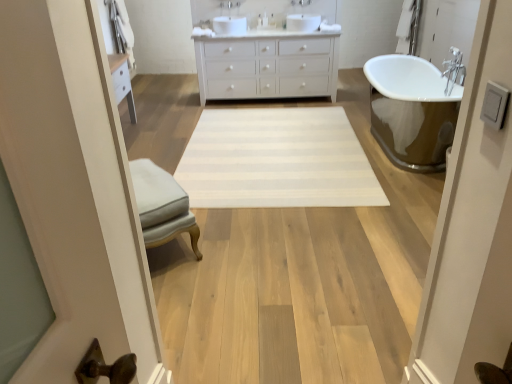
The width and height of the screenshot is (512, 384). Describe the element at coordinates (267, 65) in the screenshot. I see `white matte cabinet at center` at that location.

What is the approximate height of white matte cabinet at center?

white matte cabinet at center is 33.17 inches in height.

Find the location of a particular element. white striped rug at center is located at coordinates (277, 160).

Where is `white matte cabinet at center`? white matte cabinet at center is located at coordinates (267, 65).

Considering the positions of objects white matte cabinet at center and white striped rug at center in the image provided, who is behind, white matte cabinet at center or white striped rug at center?

white matte cabinet at center.

Is white striped rug at center completely or partially inside white matte cabinet at center?

Actually, white striped rug at center is outside white matte cabinet at center.

Who is shorter, white matte cabinet at center or white striped rug at center?

Standing shorter between the two is white striped rug at center.

Which is more to the left, white matte cabinet at center or white striped rug at center?

Positioned to the left is white striped rug at center.

Considering the sizes of objects light gray fabric ottoman at center and white striped rug at center in the image provided, who is wider, light gray fabric ottoman at center or white striped rug at center?

white striped rug at center.

From the image's perspective, is light gray fabric ottoman at center located above or below white striped rug at center?

Clearly, from the image's perspective, light gray fabric ottoman at center is below white striped rug at center.

You are a GUI agent. You are given a task and a screenshot of the screen. Output one action in this format:
    pyautogui.click(x=<x>, y=<y>)
    Task: Click on the plain below the light gray fabric ottoman at center (from a real-world perspective)
    The width and height of the screenshot is (512, 384).
    Given the screenshot: What is the action you would take?
    pyautogui.click(x=277, y=160)

Considering the positions of objects light gray fabric ottoman at center and white striped rug at center in the image provided, who is more to the left, light gray fabric ottoman at center or white striped rug at center?

light gray fabric ottoman at center is more to the left.

Is point (183, 197) farther from camera compared to point (303, 41)?

No.

Is light gray fabric ottoman at center surrounding white matte cabinet at center?

No, light gray fabric ottoman at center does not contain white matte cabinet at center.

Does light gray fabric ottoman at center appear on the right side of white matte cabinet at center?

In fact, light gray fabric ottoman at center is to the left of white matte cabinet at center.

Who is more distant, light gray fabric ottoman at center or white matte cabinet at center?

white matte cabinet at center is further away from the camera.

Visually, is white matte cabinet at center positioned to the left or to the right of light gray fabric ottoman at center?

white matte cabinet at center is positioned on light gray fabric ottoman at center's right side.

From the image's perspective, is white matte cabinet at center located above light gray fabric ottoman at center?

Yes.

Which of these two, white striped rug at center or light gray fabric ottoman at center, stands taller?

light gray fabric ottoman at center is taller.

From the image's perspective, is white striped rug at center under light gray fabric ottoman at center?

Actually, white striped rug at center appears above light gray fabric ottoman at center in the image.

Does white striped rug at center have a lesser width compared to light gray fabric ottoman at center?

No, white striped rug at center is not thinner than light gray fabric ottoman at center.

Is white striped rug at center not near white matte cabinet at center?

Yes.

Which object is closer to the camera taking this photo, white striped rug at center or white matte cabinet at center?

white striped rug at center.

At what (x,y) coordinates should I click in order to perform the action: click on bathroom cabinet above the white striped rug at center (from the image's perspective). Please return your answer as a coordinate pair (x, y). Looking at the image, I should click on (267, 65).

Where is `bathroom cabinet above the white striped rug at center (from the image's perspective)`? bathroom cabinet above the white striped rug at center (from the image's perspective) is located at coordinates (267, 65).

This screenshot has width=512, height=384. I want to click on furniture that is in front of the white striped rug at center, so click(x=162, y=205).

Looking at the image, which one is located further to white matte cabinet at center, white striped rug at center or light gray fabric ottoman at center?

The object further to white matte cabinet at center is light gray fabric ottoman at center.

Considering their positions, is white striped rug at center positioned further to light gray fabric ottoman at center than white matte cabinet at center?

white matte cabinet at center is positioned further to the anchor light gray fabric ottoman at center.

From the picture: Which object lies further to the anchor point white striped rug at center, white matte cabinet at center or light gray fabric ottoman at center?

Among the two, white matte cabinet at center is located further to white striped rug at center.

From the image, which object appears to be farther from light gray fabric ottoman at center, white matte cabinet at center or white striped rug at center?

white matte cabinet at center lies further to light gray fabric ottoman at center than the other object.

Looking at the image, which one is located further to white matte cabinet at center, light gray fabric ottoman at center or white striped rug at center?

light gray fabric ottoman at center is positioned further to the anchor white matte cabinet at center.

In the scene shown: Based on their spatial positions, is light gray fabric ottoman at center or white matte cabinet at center further from white striped rug at center?

white matte cabinet at center is positioned further to the anchor white striped rug at center.

Identify the location of plain between light gray fabric ottoman at center and white matte cabinet at center along the z-axis. (277, 160).